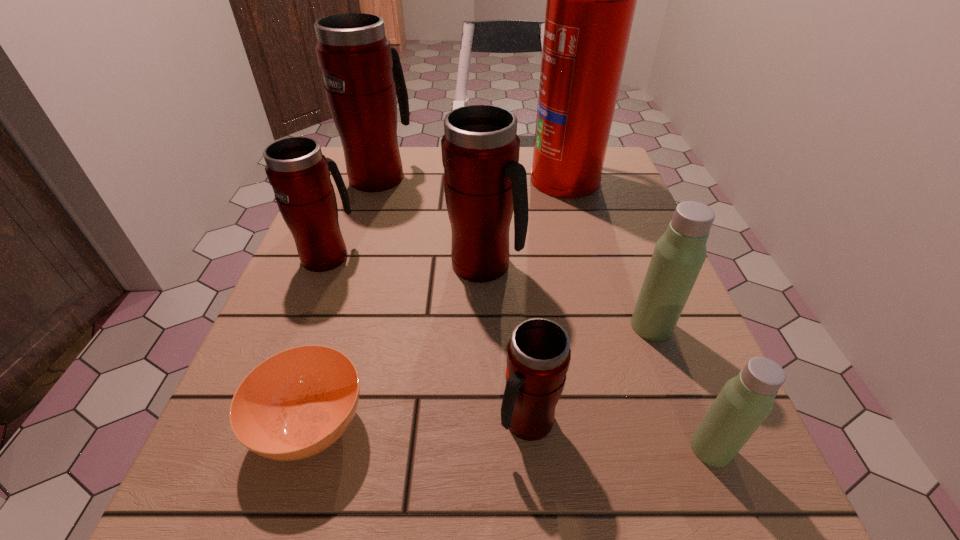
Locate an element on the screen. The image size is (960, 540). the nearer light thermos bottle is located at coordinates (745, 401).

You are a GUI agent. You are given a task and a screenshot of the screen. Output one action in this format:
    pyautogui.click(x=<x>, y=<y>)
    Task: Click on the soup bowl
    This screenshot has width=960, height=540.
    Given the screenshot: What is the action you would take?
    pyautogui.click(x=297, y=403)

I want to click on the shortest object, so [x=297, y=403].

Identify the location of vacant space located 0.380m on the instruction side of the red fire extinguisher. This screenshot has height=540, width=960. (381, 177).

The width and height of the screenshot is (960, 540). Identify the location of vacant space positioned on the instruction side of the red fire extinguisher. (510, 177).

You are a GUI agent. You are given a task and a screenshot of the screen. Output one action in this format:
    pyautogui.click(x=<x>, y=<y>)
    Task: Click on the free space located on the instruction side of the red fire extinguisher
    The image size is (960, 540).
    Given the screenshot: What is the action you would take?
    pyautogui.click(x=468, y=177)

You are a GUI agent. You are given a task and a screenshot of the screen. Output one action in this format:
    pyautogui.click(x=<x>, y=<y>)
    Task: Click on the free space located 0.080m on the side with the handle of the farthest thermos bottle
    
    Given the screenshot: What is the action you would take?
    pyautogui.click(x=390, y=146)

This screenshot has height=540, width=960. Find the location of `free spot located 0.280m on the side with the handle of the third tallest object`. free spot located 0.280m on the side with the handle of the third tallest object is located at coordinates (661, 265).

Where is `free space located on the front of the fourth nearest object`? The image size is (960, 540). free space located on the front of the fourth nearest object is located at coordinates (701, 460).

Find the location of a particular element. The height and width of the screenshot is (540, 960). vacant space located on the side with the handle of the third biggest red thermos bottle is located at coordinates (352, 192).